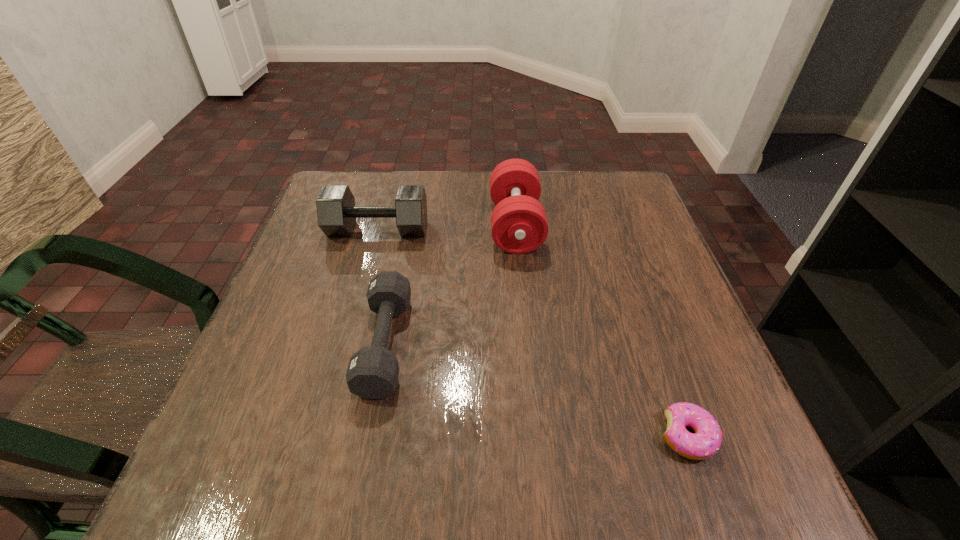
Where is `object that is positioned at the near edge`? The height and width of the screenshot is (540, 960). object that is positioned at the near edge is located at coordinates (706, 441).

Where is `object present at the left edge`? The height and width of the screenshot is (540, 960). object present at the left edge is located at coordinates (336, 211).

Identify the location of object that is positioned at the right edge. The height and width of the screenshot is (540, 960). (706, 441).

Find the location of a particular element. object that is positioned at the far left corner is located at coordinates (336, 211).

In order to click on object at the near right corner in this screenshot , I will do `click(706, 441)`.

Locate an element on the screen. The width and height of the screenshot is (960, 540). vacant space at the far edge of the desktop is located at coordinates (413, 179).

This screenshot has height=540, width=960. I want to click on vacant space at the near edge, so click(x=355, y=451).

Image resolution: width=960 pixels, height=540 pixels. I want to click on vacant space at the left edge of the desktop, so click(342, 264).

The height and width of the screenshot is (540, 960). In order to click on free point at the right edge in this screenshot , I will do `click(724, 379)`.

Locate an element on the screen. vacant area at the far left corner of the desktop is located at coordinates (348, 185).